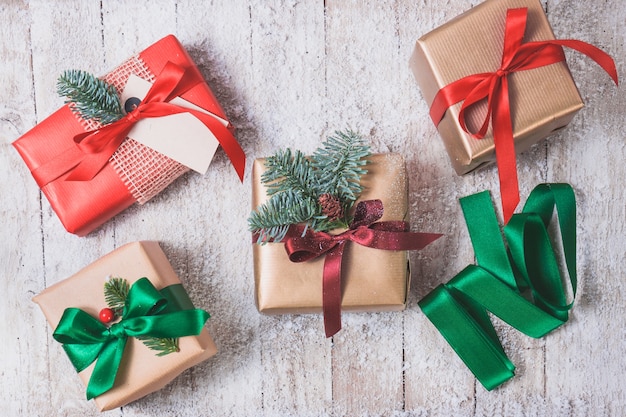
You are a GUI agent. You are given a task and a screenshot of the screen. Output one action in this format:
    pyautogui.click(x=<x>, y=<y>)
    Task: Click on the gift box
    The height and width of the screenshot is (417, 626).
    Given the screenshot: What is the action you would take?
    pos(47,152), pos(91,284), pos(290,289), pos(464,48)